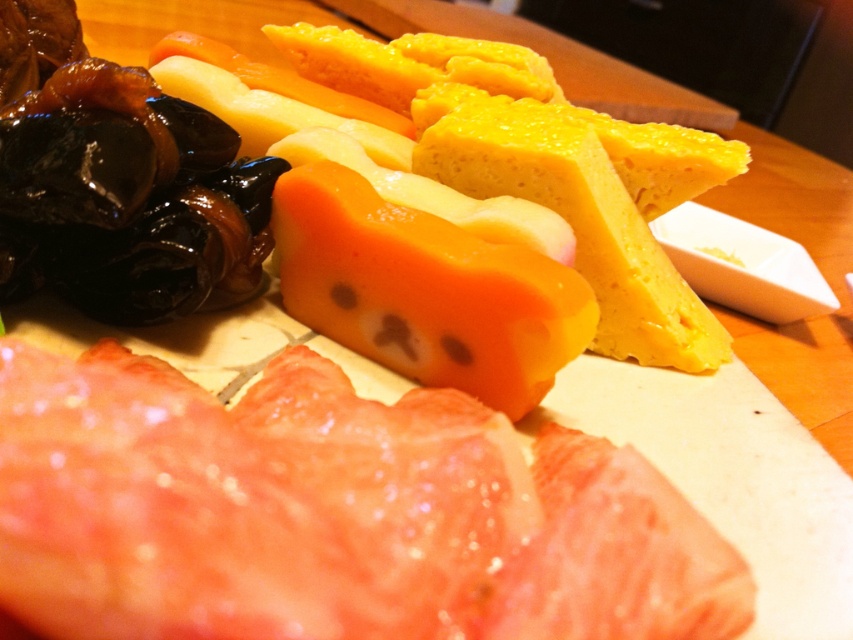
Question: Can you confirm if pink raw meat at lower left is bigger than yellow crumbly cheese at center?

Choices:
 (A) no
 (B) yes

Answer: (B)

Question: Is pink raw meat at lower left thinner than yellow crumbly cheese at upper center?

Choices:
 (A) no
 (B) yes

Answer: (B)

Question: Based on their relative distances, which object is farther from the pink raw meat at lower left?

Choices:
 (A) yellow crumbly cheese at upper center
 (B) yellow crumbly cheese at center

Answer: (B)

Question: Considering the relative positions of yellow crumbly cheese at upper center and yellow crumbly cheese at center in the image provided, where is yellow crumbly cheese at upper center located with respect to yellow crumbly cheese at center?

Choices:
 (A) above
 (B) below

Answer: (A)

Question: Which point is farther to the camera?

Choices:
 (A) yellow crumbly cheese at upper center
 (B) yellow crumbly cheese at center

Answer: (B)

Question: Which is nearer to the yellow crumbly cheese at upper center?

Choices:
 (A) yellow crumbly cheese at center
 (B) pink raw meat at lower left

Answer: (A)